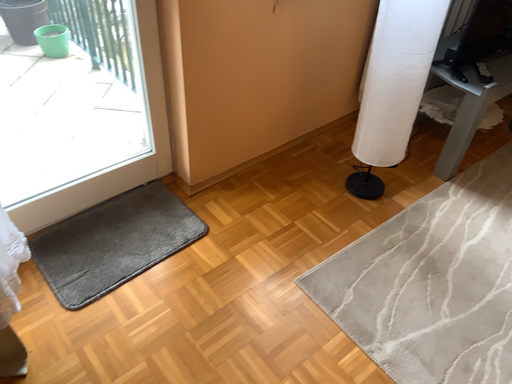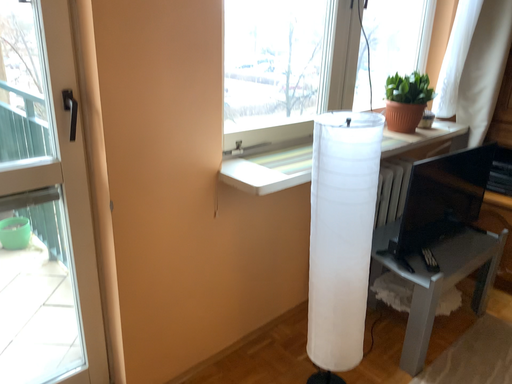
Question: Which way did the camera rotate in the video?

Choices:
 (A) rotated upward
 (B) rotated downward

Answer: (A)